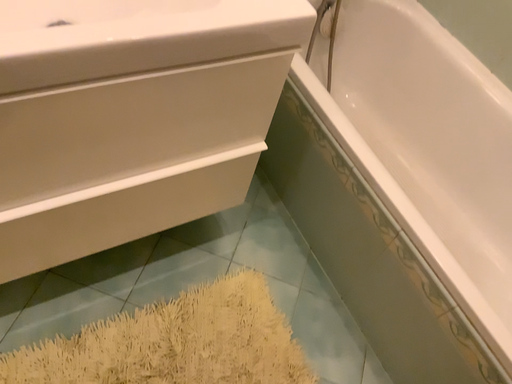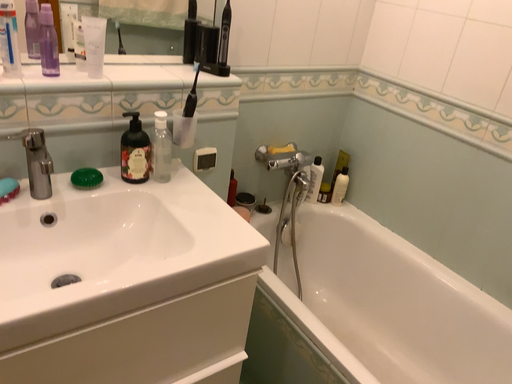
Question: How did the camera likely rotate when shooting the video?

Choices:
 (A) rotated upward
 (B) rotated downward

Answer: (A)